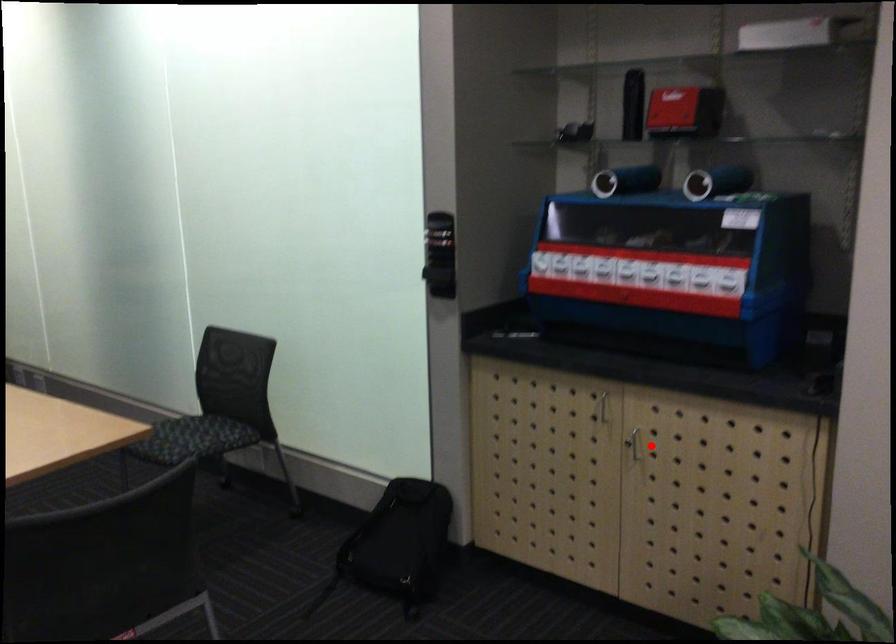
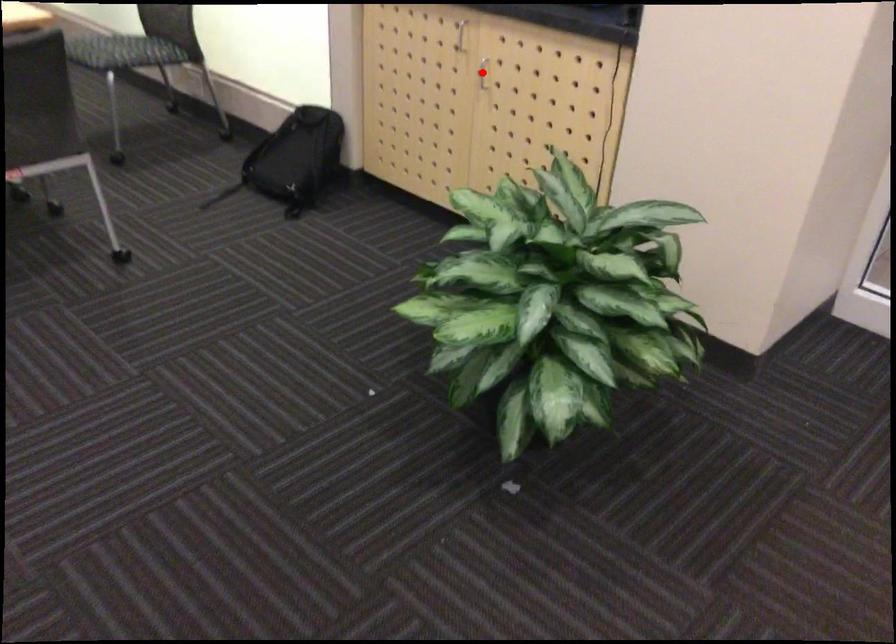
I am providing you with two images of the same scene from different viewpoints. A red point is marked on the first image and another point is marked on the second image. Is the marked point in image1 the same physical position as the marked point in image2?

Yes